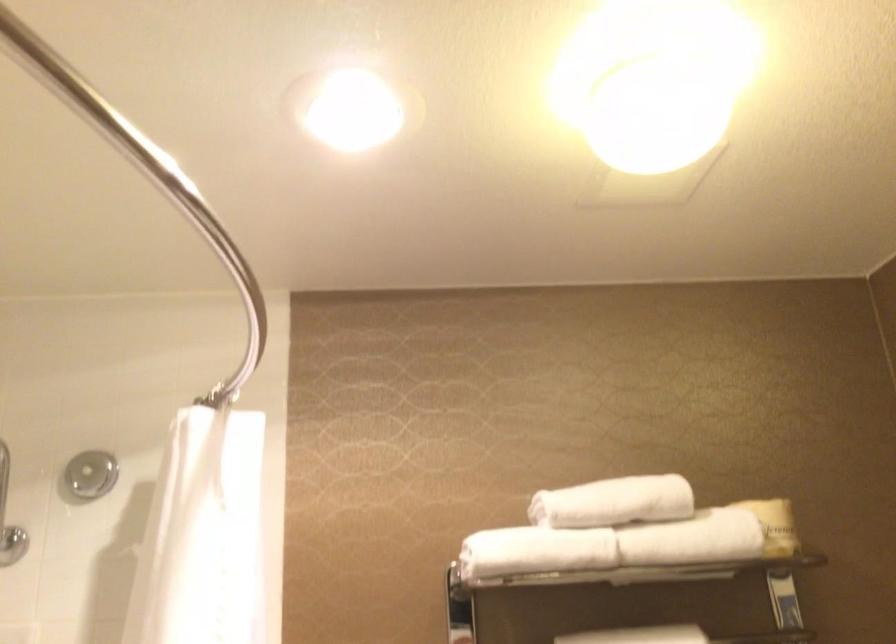
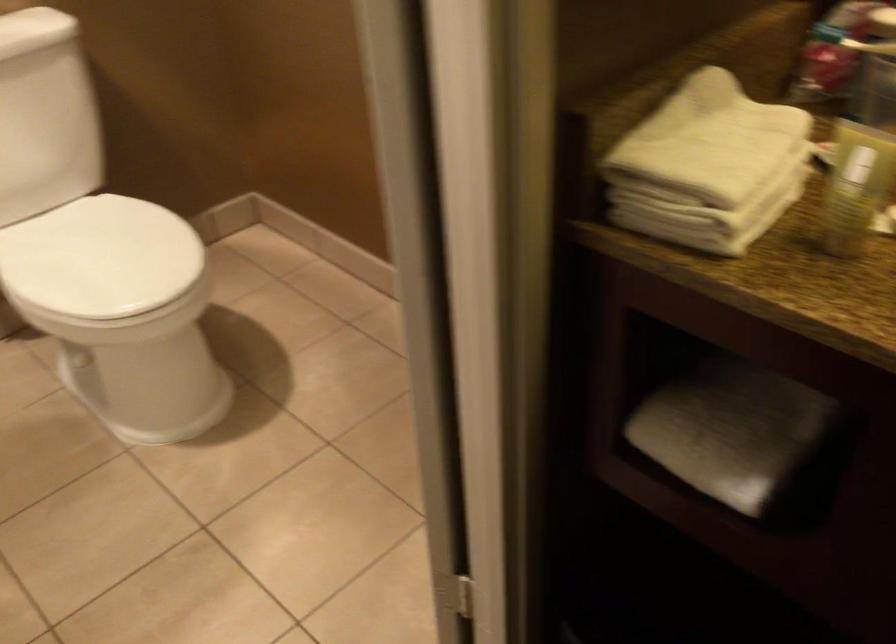
In the scene shown: Based on the continuous images, in which direction is the camera rotating?

The camera rotated toward right-down.